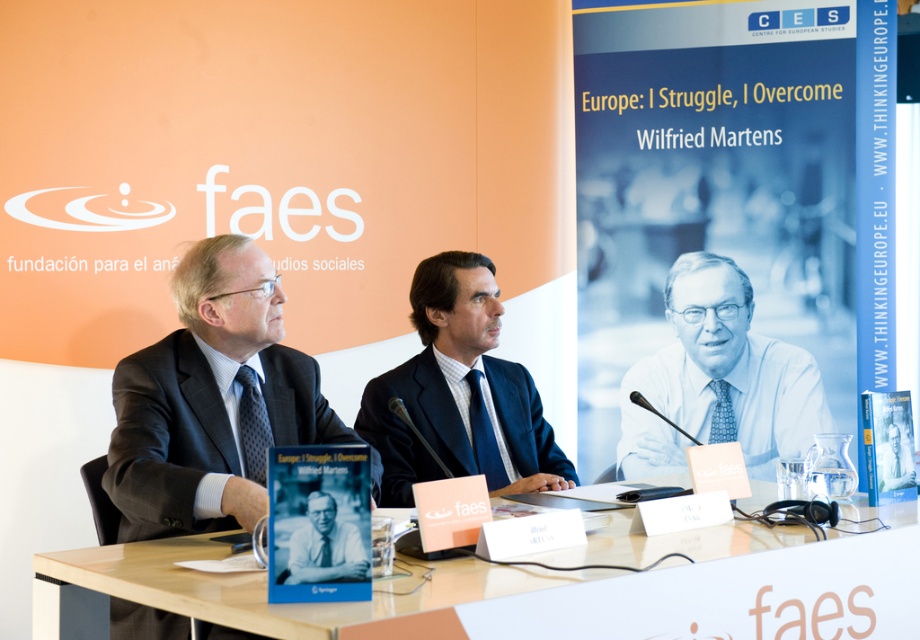
Question: Which point is farther to the camera?

Choices:
 (A) (468, 403)
 (B) (325, 496)
 (C) (92, 566)
 (D) (198, 282)

Answer: (A)

Question: Which of these objects is positioned farthest from the light blue tie at center?

Choices:
 (A) matte black book at center
 (B) wooden table at center

Answer: (A)

Question: Does wooden table at center have a lesser width compared to light blue tie at center?

Choices:
 (A) yes
 (B) no

Answer: (B)

Question: Which object appears farthest from the camera in this image?

Choices:
 (A) dark blue suit at center
 (B) matte black book at center
 (C) wooden table at center
 (D) dark gray suit at left

Answer: (A)

Question: Does dark gray suit at left come in front of matte black book at center?

Choices:
 (A) no
 (B) yes

Answer: (A)

Question: Is dark blue suit at center closer to camera compared to light blue tie at center?

Choices:
 (A) no
 (B) yes

Answer: (B)